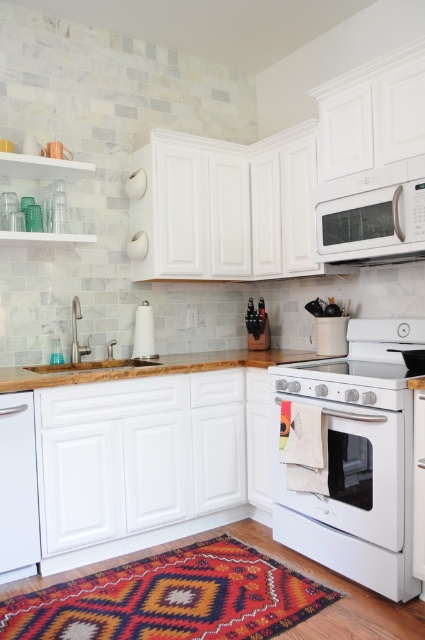
You are a chef who wants to place a large pot on the counter near the white glossy oven at center. However, the wooden sink at lower left is in the way. Can you move the pot to the area between them?

The white glossy oven at center is positioned under the wooden sink at lower left, so the oven is below the sink. Since the sink is above the oven, there is no space between them to place the pot.

You are standing in the kitchen and need to place a large pot on the counter near the white glossy oven at center. Based on the oven location, where should you place the pot?

The white glossy oven at center is located at point (373,476). Place the pot near that coordinate on the counter for optimal positioning.

You are standing in the kitchen and want to reach both the white glossy oven at center and the white glossy microwave at upper center. Which appliance will require you to reach higher?

The white glossy microwave at upper center requires reaching higher because it is positioned above the white glossy oven at center, which is closer to you.